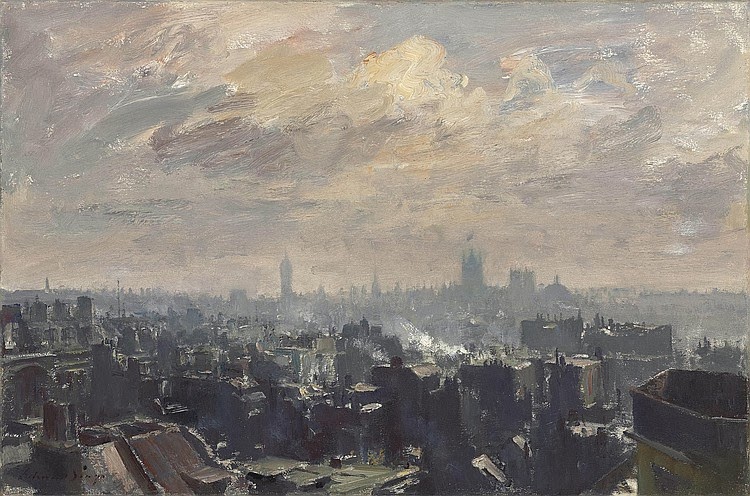
Find the location of a particular element. The image size is (750, 496). chimney is located at coordinates (58, 411).